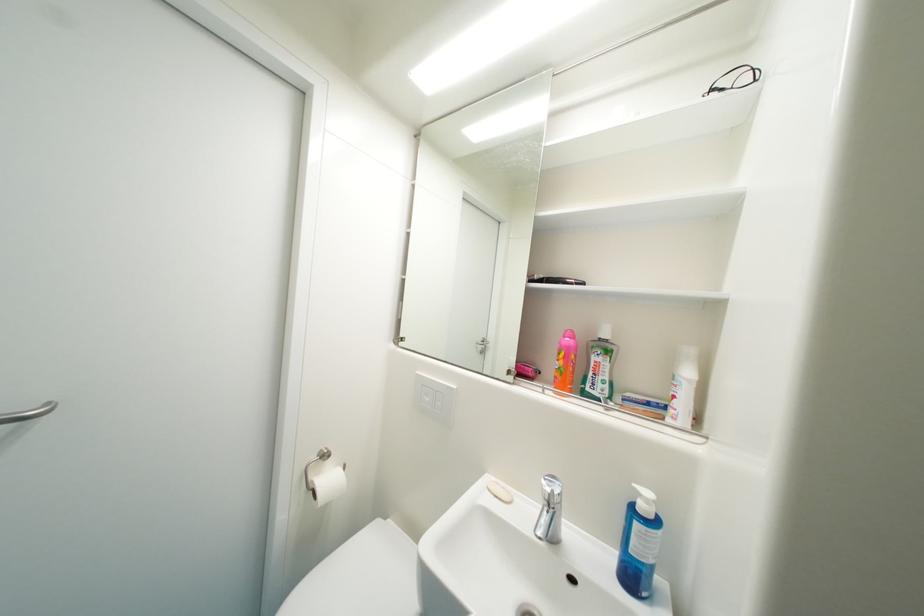
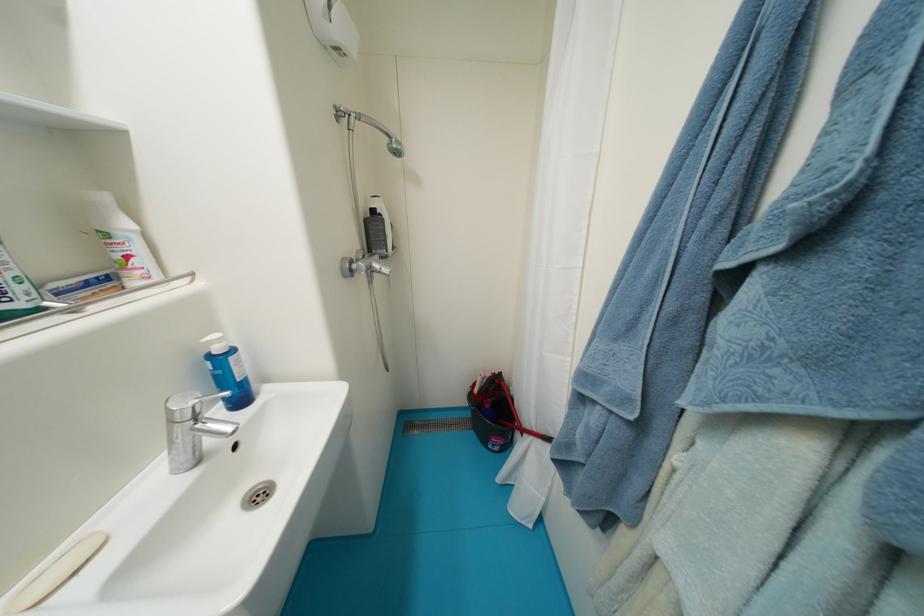
The point at (681, 399) is marked in the first image. Where is the corresponding point in the second image?

(134, 259)